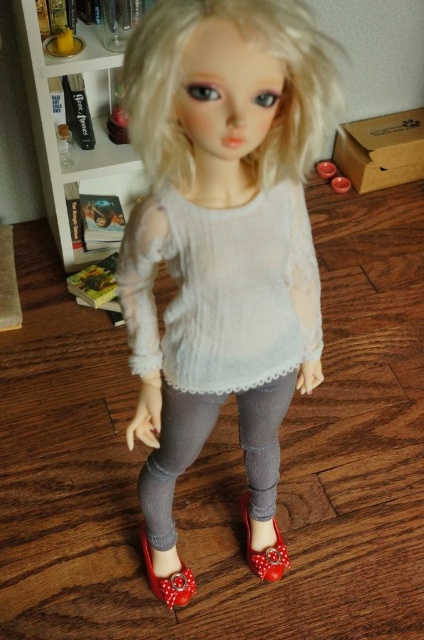
Based on the photo, can you confirm if light gray knitted sweater at center is thinner than gray matte leggings at center?

Incorrect, light gray knitted sweater at center's width is not less than gray matte leggings at center's.

Is light gray knitted sweater at center below gray matte leggings at center?

No.

Which is behind, point (231, 257) or point (254, 516)?

Positioned behind is point (254, 516).

Identify the location of light gray knitted sweater at center. (222, 289).

Which of these two, light gray knitted sweater at center or shiny red sandal at lower center, stands shorter?

Standing shorter between the two is shiny red sandal at lower center.

Is light gray knitted sweater at center to the right of shiny red sandal at lower center from the viewer's perspective?

Correct, you'll find light gray knitted sweater at center to the right of shiny red sandal at lower center.

Between point (164, 352) and point (187, 576), which one is positioned in front?

Point (164, 352) is in front.

The width and height of the screenshot is (424, 640). Identify the location of light gray knitted sweater at center. (222, 289).

Does matte gray leggings at center lie behind light gray knitted sweater at center?

No, matte gray leggings at center is closer to the viewer.

Is matte gray leggings at center below light gray knitted sweater at center?

Indeed, matte gray leggings at center is positioned under light gray knitted sweater at center.

Describe the element at coordinates (222, 236) in the screenshot. I see `matte gray leggings at center` at that location.

At what (x,y) coordinates should I click in order to perform the action: click on matte gray leggings at center. Please return your answer as a coordinate pair (x, y). Looking at the image, I should click on (222, 236).